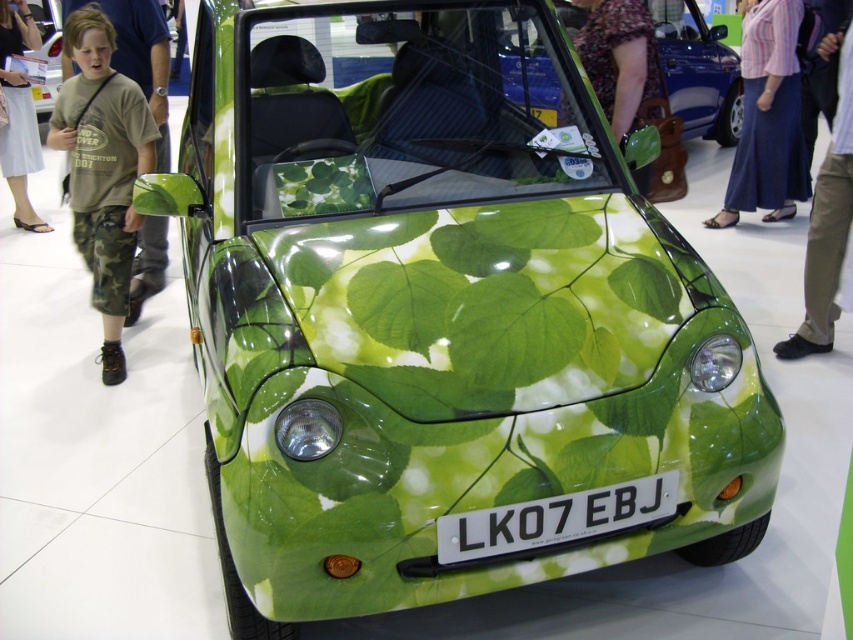
Who is positioned more to the left, tan leather shoes at lower right or floral dress at center?

Positioned to the left is floral dress at center.

Describe the element at coordinates (827, 216) in the screenshot. I see `tan leather shoes at lower right` at that location.

Find the location of a particular element. tan leather shoes at lower right is located at coordinates (x=827, y=216).

Which is more to the left, white plastic license plate at center or floral dress at center?

From the viewer's perspective, white plastic license plate at center appears more on the left side.

Is point (469, 554) less distant than point (584, 48)?

Yes, it is.

Which is in front, point (476, 557) or point (660, 81)?

Point (476, 557) is in front.

The height and width of the screenshot is (640, 853). Find the location of `white plastic license plate at center`. white plastic license plate at center is located at coordinates (555, 518).

Can you confirm if green camo pants at left is positioned to the left of white plastic license plate at center?

Yes, green camo pants at left is to the left of white plastic license plate at center.

How distant is green camo pants at left from white plastic license plate at center?

green camo pants at left and white plastic license plate at center are 2.95 meters apart.

What do you see at coordinates (102, 168) in the screenshot?
I see `green camo pants at left` at bounding box center [102, 168].

This screenshot has height=640, width=853. I want to click on green camo pants at left, so click(x=102, y=168).